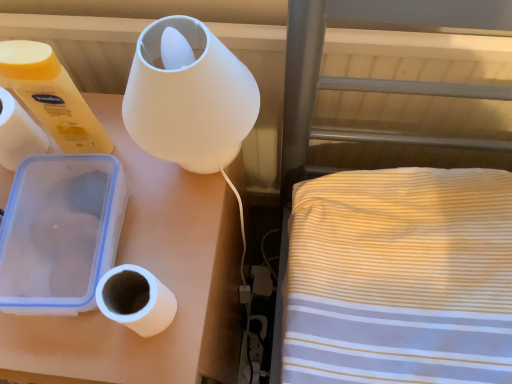
Question: Is white matte toilet paper at left, which is the second toilet paper from bottom to top, oriented towards white matte paper towel at left?

Choices:
 (A) yes
 (B) no

Answer: (B)

Question: Is white matte toilet paper at left, positioned as the 2th toilet paper in right-to-left order, not close to white matte paper towel at left?

Choices:
 (A) no
 (B) yes

Answer: (A)

Question: Considering the relative sizes of white matte toilet paper at left, positioned as the first toilet paper in top-to-bottom order, and white matte paper towel at left in the image provided, is white matte toilet paper at left, positioned as the first toilet paper in top-to-bottom order, smaller than white matte paper towel at left?

Choices:
 (A) yes
 (B) no

Answer: (B)

Question: Considering the relative positions of white matte toilet paper at left, the first toilet paper from the left, and white matte paper towel at left in the image provided, is white matte toilet paper at left, the first toilet paper from the left, to the left of white matte paper towel at left from the viewer's perspective?

Choices:
 (A) yes
 (B) no

Answer: (B)

Question: Does white matte toilet paper at left, which is the second toilet paper from bottom to top, have a lesser width compared to white matte paper towel at left?

Choices:
 (A) no
 (B) yes

Answer: (B)

Question: Looking at their shapes, would you say white matte paper towel at left is wider or thinner than white matte toilet paper at lower left, positioned as the first toilet paper in right-to-left order?

Choices:
 (A) thin
 (B) wide

Answer: (B)

Question: In the image, is white matte paper towel at left positioned in front of or behind white matte toilet paper at lower left, the second toilet paper viewed from the top?

Choices:
 (A) front
 (B) behind

Answer: (B)

Question: Is white matte paper towel at left to the left or to the right of white matte toilet paper at lower left, which is counted as the 2th toilet paper, starting from the left, in the image?

Choices:
 (A) right
 (B) left

Answer: (B)

Question: Would you say white matte paper towel at left is inside or outside white matte toilet paper at lower left, which is counted as the 2th toilet paper, starting from the left?

Choices:
 (A) outside
 (B) inside

Answer: (A)

Question: Looking at their shapes, would you say white matte toilet paper at lower left, the first toilet paper ordered from the bottom, is wider or thinner than white matte toilet paper at left, positioned as the first toilet paper in top-to-bottom order?

Choices:
 (A) thin
 (B) wide

Answer: (A)

Question: Based on their positions, is white matte toilet paper at lower left, the first toilet paper ordered from the bottom, located to the left or right of white matte toilet paper at left, positioned as the first toilet paper in top-to-bottom order?

Choices:
 (A) right
 (B) left

Answer: (A)

Question: From the image's perspective, is white matte toilet paper at lower left, the second toilet paper viewed from the top, above or below white matte toilet paper at left, positioned as the 2th toilet paper in right-to-left order?

Choices:
 (A) below
 (B) above

Answer: (A)

Question: Is white matte toilet paper at lower left, positioned as the first toilet paper in right-to-left order, in front of or behind white matte toilet paper at left, positioned as the first toilet paper in top-to-bottom order, in the image?

Choices:
 (A) front
 (B) behind

Answer: (A)

Question: From the image's perspective, is white matte paper towel at left above or below white matte toilet paper at left, the first toilet paper from the left?

Choices:
 (A) above
 (B) below

Answer: (B)

Question: Is white matte paper towel at left inside or outside of white matte toilet paper at left, positioned as the first toilet paper in top-to-bottom order?

Choices:
 (A) inside
 (B) outside

Answer: (B)